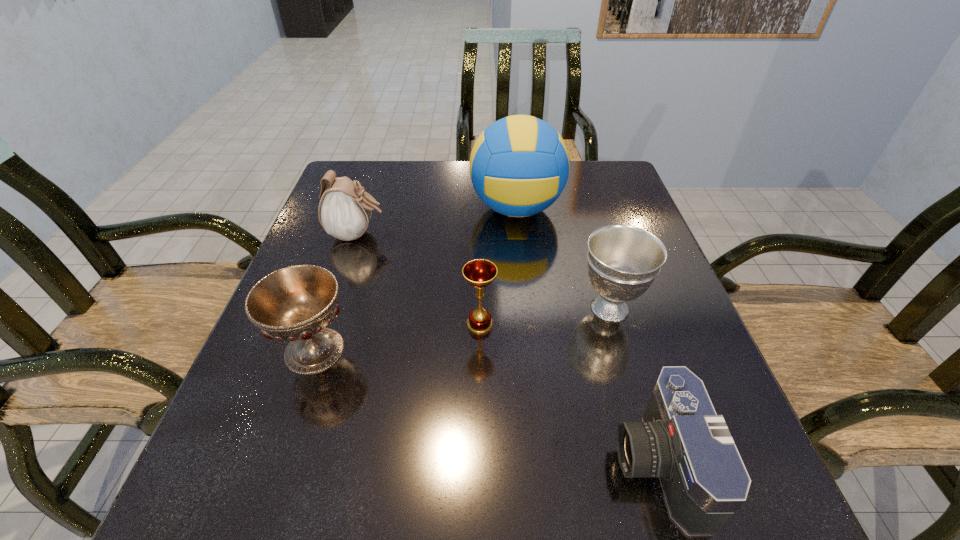
The width and height of the screenshot is (960, 540). I want to click on vacant space that satisfies the following two spatial constraints: 1. on the front-facing side of the second chalice from left to right; 2. on the left side of the pouch, so click(327, 325).

Find the location of a particular element. This screenshot has height=540, width=960. vacant space that satisfies the following two spatial constraints: 1. on the back side of the second chalice from right to left; 2. on the left side of the tallest object is located at coordinates 480,208.

The image size is (960, 540). I want to click on vacant space that satisfies the following two spatial constraints: 1. on the back side of the rightmost chalice; 2. on the front-facing side of the pouch, so click(588, 234).

The width and height of the screenshot is (960, 540). In order to click on vacant point that satisfies the following two spatial constraints: 1. on the front-facing side of the pouch; 2. on the front side of the leftmost chalice in this screenshot , I will do `click(319, 350)`.